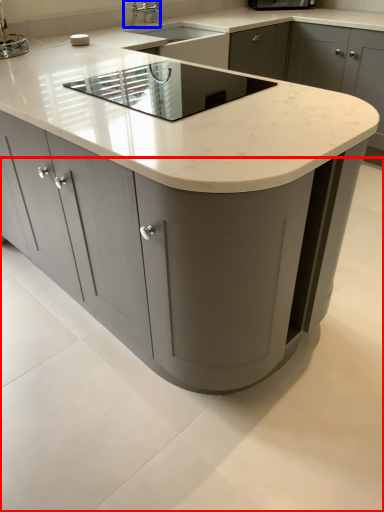
Question: Among these objects, which one is nearest to the camera, concrete (highlighted by a red box) or tap (highlighted by a blue box)?

Choices:
 (A) concrete
 (B) tap

Answer: (A)